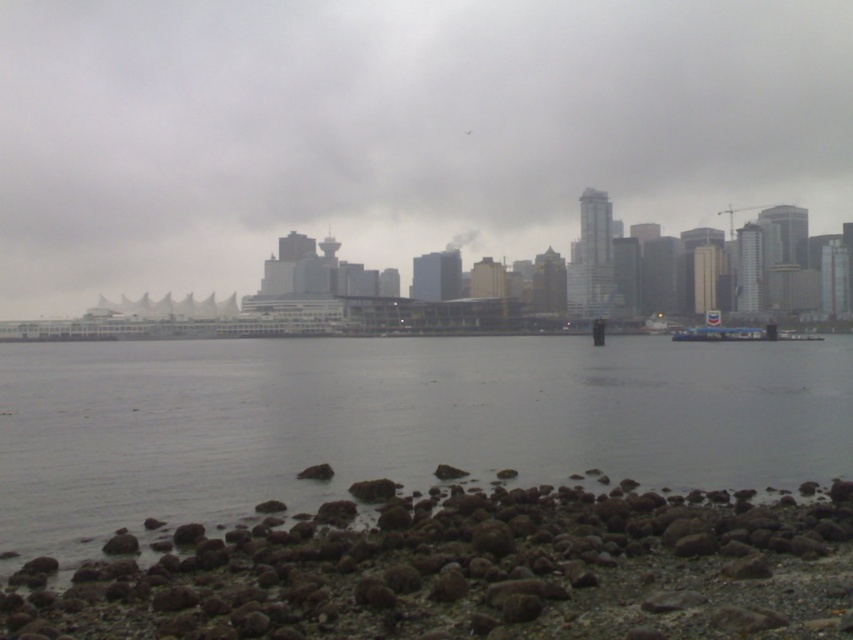
From the picture: You are standing on the pebbled beach and want to place a small flag between the rusty gravel rocks at lower left and the white plastic boat at lower right. Which object should you place the flag closer to if you want the flag to be more visible from the water? Explain your reasoning based on their heights.

You should place the flag closer to the white plastic boat at lower right because it has a greater height than the rusty gravel rocks at lower left. This will ensure the flag is elevated and more visible from the water.

You are standing on the rocky shoreline and see the gray water at center and the white plastic boat at lower right. Which object is taller from your viewpoint?

The white plastic boat at lower right is taller than the gray water at center.